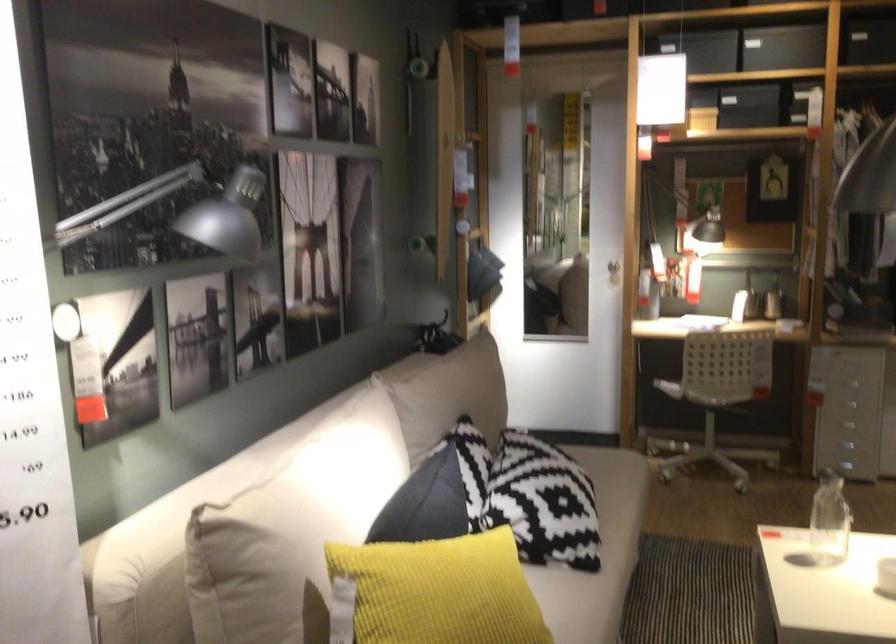
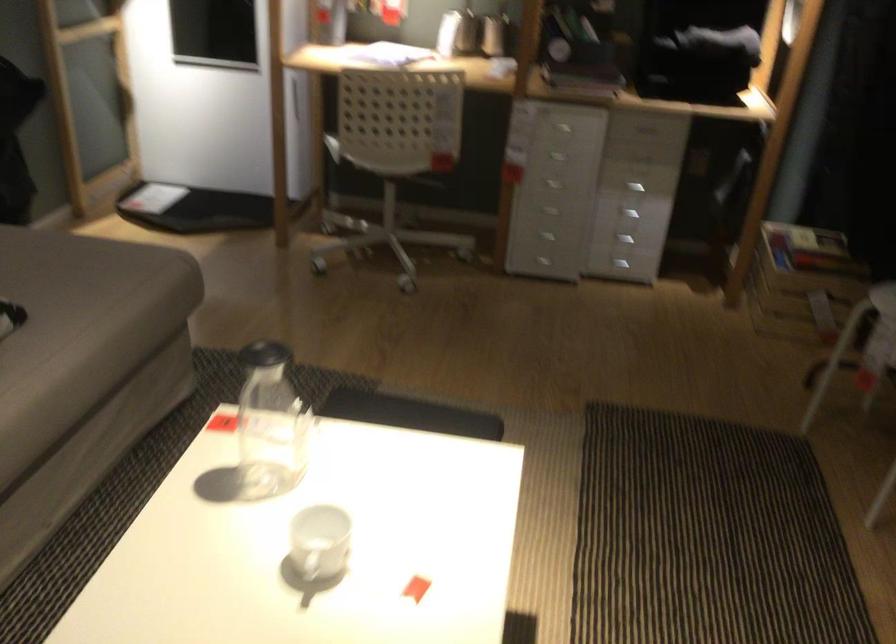
In a continuous first-person perspective shot, in which direction is the camera moving?

The cameraman walked toward right, forward.